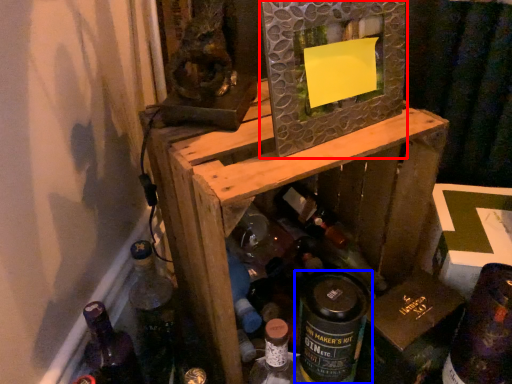
Question: Which object is closer to the camera taking this photo, picture frame (highlighted by a red box) or bottle (highlighted by a blue box)?

Choices:
 (A) picture frame
 (B) bottle

Answer: (A)